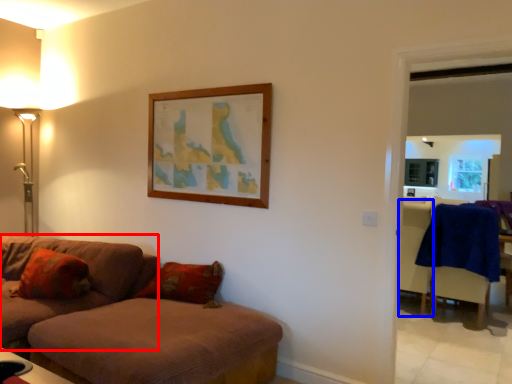
Question: Which point is closer to the camera, studio couch (highlighted by a red box) or armchair (highlighted by a blue box)?

Choices:
 (A) studio couch
 (B) armchair

Answer: (A)